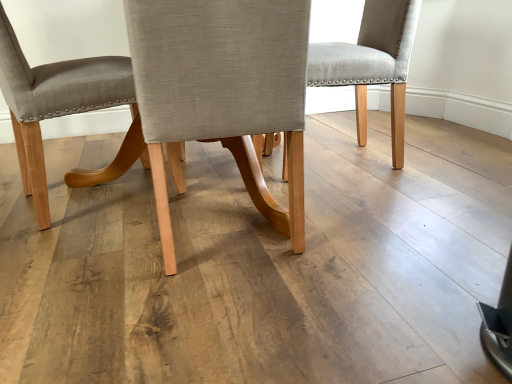
Identify the location of vacant space underneath light gray fabric chair at center, which is counted as the second chair, starting from the left (from a real-world perspective). The image size is (512, 384). (228, 240).